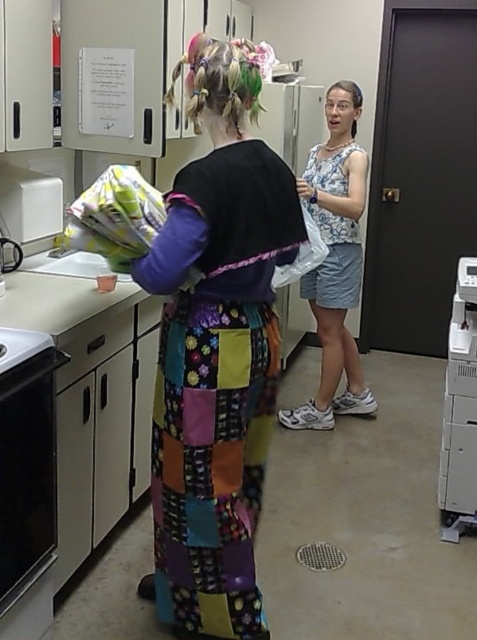
Is patchwork apron at center wider than white plastic printer at right?

Indeed, patchwork apron at center has a greater width compared to white plastic printer at right.

Is point (173, 432) farther from viewer compared to point (445, 472)?

No, (173, 432) is in front of (445, 472).

What are the coordinates of `patchwork apron at center` in the screenshot? It's located at (217, 349).

Based on the photo, between floral fabric dress at center and white plastic printer at right, which one has less height?

With less height is white plastic printer at right.

Who is taller, floral fabric dress at center or white plastic printer at right?

Standing taller between the two is floral fabric dress at center.

I want to click on floral fabric dress at center, so click(x=334, y=260).

The height and width of the screenshot is (640, 477). What are the coordinates of `floral fabric dress at center` in the screenshot? It's located at (334, 260).

Is point (253, 166) less distant than point (1, 461)?

That is False.

Who is higher up, patchwork apron at center or black glass oven at lower left?

Positioned higher is patchwork apron at center.

Find the location of a particular element. patchwork apron at center is located at coordinates (217, 349).